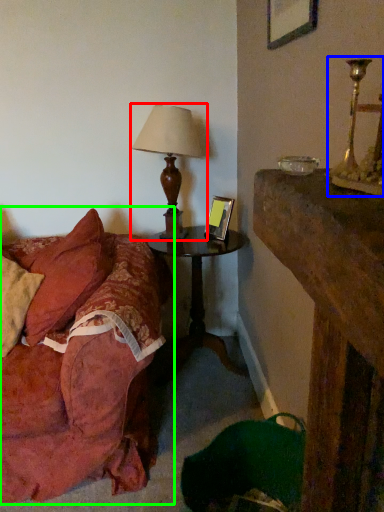
Question: Which object is positioned farthest from lamp (highlighted by a red box)? Select from candle holder (highlighted by a blue box) and studio couch (highlighted by a green box).

Choices:
 (A) candle holder
 (B) studio couch

Answer: (A)